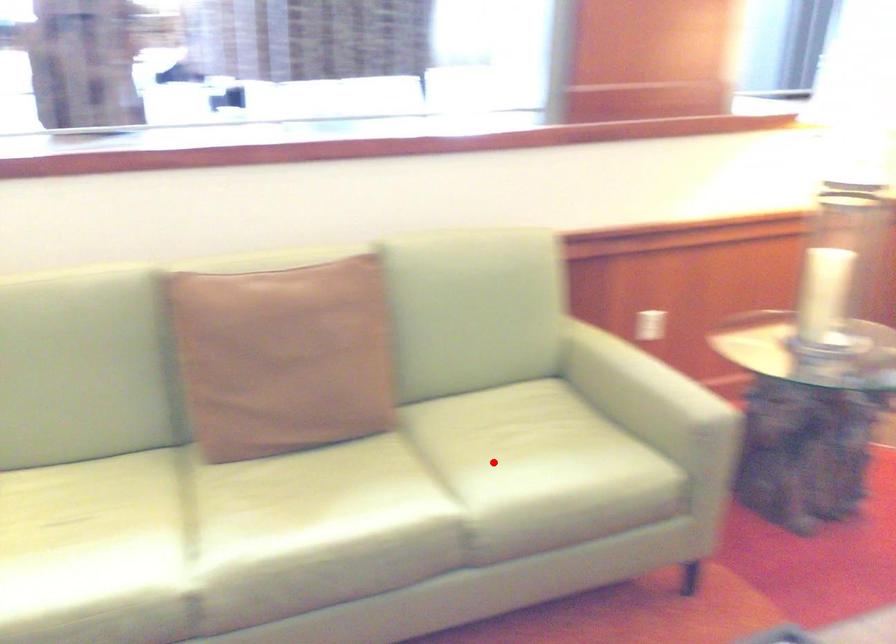
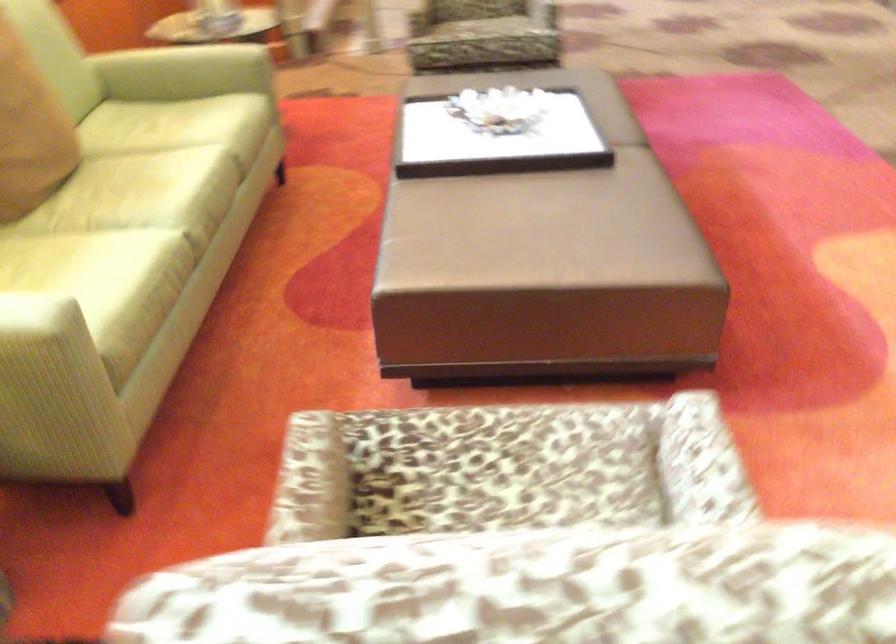
The point at the highlighted location is marked in the first image. Where is the corresponding point in the second image?

(177, 126)